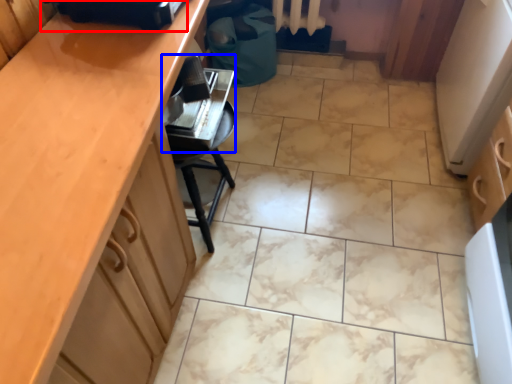
Question: Which object is closer to the camera taking this photo, appliance (highlighted by a red box) or appliance (highlighted by a blue box)?

Choices:
 (A) appliance
 (B) appliance

Answer: (A)